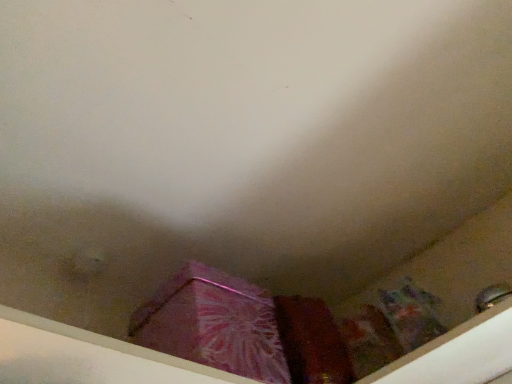
Identify the location of pink shiny box at center. (213, 324).

Describe the element at coordinates (213, 324) in the screenshot. This screenshot has height=384, width=512. I see `pink shiny box at center` at that location.

Identify the location of pink shiny box at center. Image resolution: width=512 pixels, height=384 pixels. (213, 324).